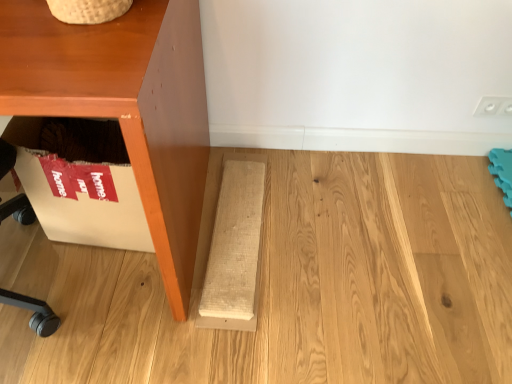
The height and width of the screenshot is (384, 512). I want to click on free spot to the right of matte brown cabinet at left, so click(313, 252).